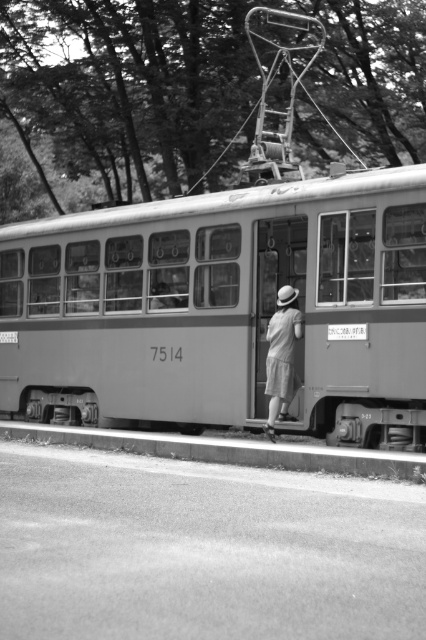
Looking at this image, in the black and white photo, there is a smooth concrete curb at lower center and light gray cotton shorts at center. Which object is positioned to the right of the other?

The smooth concrete curb at lower center is to the right of the light gray cotton shorts at center.

You are standing at the point with coordinates point (282, 400) and want to walk to the point with coordinates point (135, 413). According to the tram scene, will you have to walk forward or backward to reach your destination?

You will have to walk forward to reach point (135, 413) because it is behind point (282, 400), meaning moving towards it requires forward movement from your current position.